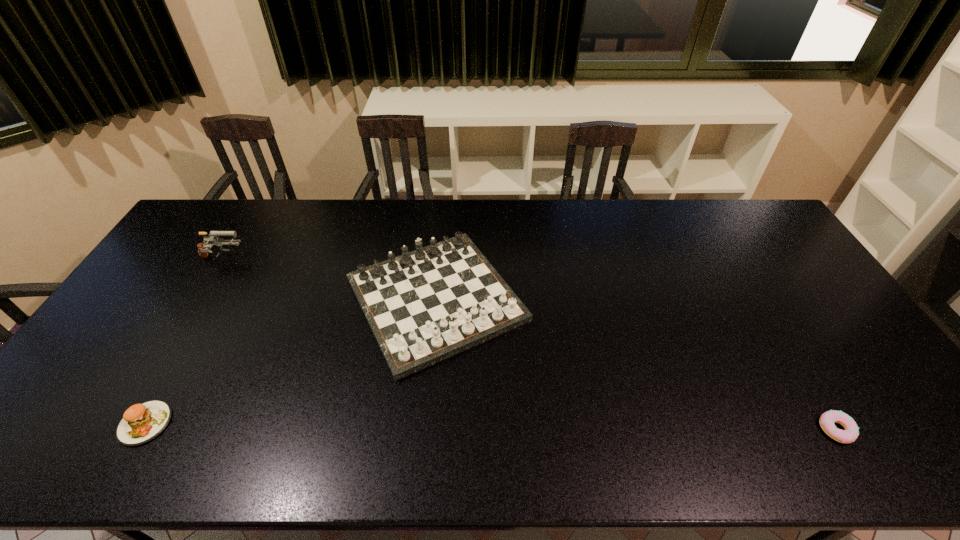
Identify the location of vacant space that satisfies the following two spatial constraints: 1. at the barrel end of the third object from left to right; 2. on the right side of the gun. (198, 299).

Find the location of `vacant space that satisfies the following two spatial constraints: 1. at the barrel end of the gun; 2. on the left side of the second object from right to left`. vacant space that satisfies the following two spatial constraints: 1. at the barrel end of the gun; 2. on the left side of the second object from right to left is located at coordinates (198, 299).

Locate an element on the screen. The width and height of the screenshot is (960, 540). vacant point that satisfies the following two spatial constraints: 1. on the back side of the patty; 2. at the barrel end of the gun is located at coordinates (239, 259).

You are a GUI agent. You are given a task and a screenshot of the screen. Output one action in this format:
    pyautogui.click(x=<x>, y=<y>)
    Task: Click on the vacant space that satisfies the following two spatial constraints: 1. at the barrel end of the gun; 2. on the left side of the patty
    Image resolution: width=960 pixels, height=540 pixels.
    Given the screenshot: What is the action you would take?
    pyautogui.click(x=123, y=423)

Find the location of a particular element. The height and width of the screenshot is (540, 960). free location that satisfies the following two spatial constraints: 1. at the barrel end of the gun; 2. on the right side of the doughnut is located at coordinates (119, 429).

Where is `vacant space that satisfies the following two spatial constraints: 1. at the barrel end of the gun; 2. on the back side of the doughnut`? The width and height of the screenshot is (960, 540). vacant space that satisfies the following two spatial constraints: 1. at the barrel end of the gun; 2. on the back side of the doughnut is located at coordinates (119, 429).

Locate an element on the screen. The width and height of the screenshot is (960, 540). free region that satisfies the following two spatial constraints: 1. on the back side of the doughnut; 2. at the barrel end of the gun is located at coordinates (734, 259).

Image resolution: width=960 pixels, height=540 pixels. Identify the location of free region that satisfies the following two spatial constraints: 1. at the barrel end of the gun; 2. on the back side of the third tallest object. (123, 423).